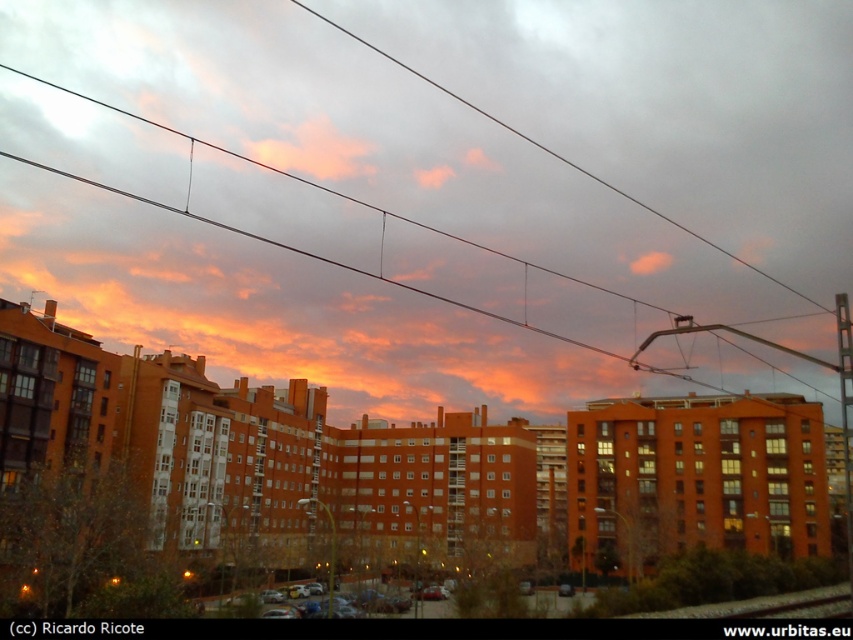
You are standing in the urban area and want to take a photo of the orange sky at center. Where should you aim your camera to capture it?

The orange sky at center is located at coordinates point (430,184). Aim your camera there to capture it.

In the scene shown: You are standing at the edge of the black metal train track at lower right and looking towards the orange sky at center. Which one appears wider from your perspective?

The orange sky at center appears wider than the black metal train track at lower right because its width surpasses that of the track.

You are standing at the edge of the black metal train track at lower right and looking towards the orange sky at center. Which object is higher in the scene?

The orange sky at center is taller than the black metal train track at lower right, so the orange sky at center is higher in the scene.